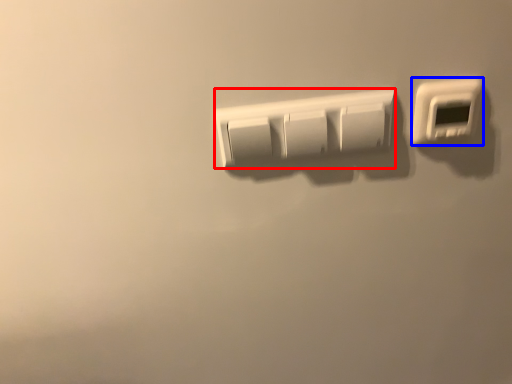
Question: Which object is further to the camera taking this photo, light switch (highlighted by a red box) or light switch (highlighted by a blue box)?

Choices:
 (A) light switch
 (B) light switch

Answer: (A)